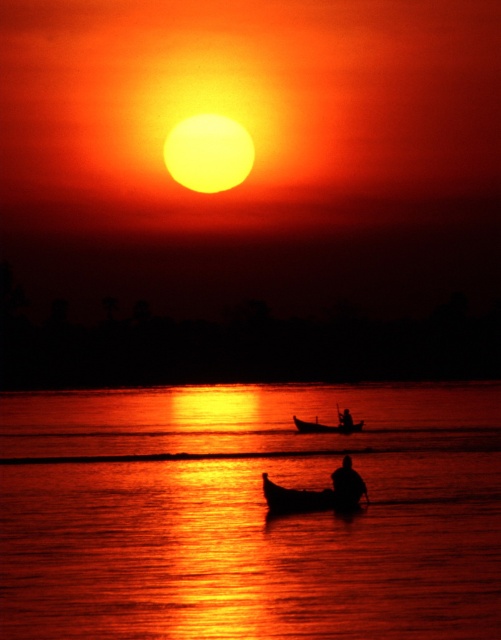
Is point (348, 429) positioned behind point (339, 419)?

No, (348, 429) is in front of (339, 419).

Is point (342, 412) in front of point (338, 410)?

Yes, point (342, 412) is closer to viewer.

I want to click on silhouette wood person at center, so click(x=345, y=419).

Does glossy water at center have a smaller size compared to smooth wooden boat at center?

No.

How much distance is there between glossy water at center and smooth wooden boat at center?

44.38 feet

Who is more forward, [154,625] or [360,488]?

Point [154,625] is in front.

Locate an element on the screen. glossy water at center is located at coordinates (248, 513).

Between point (325, 496) and point (316, 433), which one is positioned behind?

Point (316, 433)

Which is in front, point (310, 500) or point (300, 429)?

Point (310, 500)

Is point (349, 492) behind point (359, 420)?

No, (349, 492) is in front of (359, 420).

This screenshot has width=501, height=640. Identify the location of smooth wooden boat at center. (317, 493).